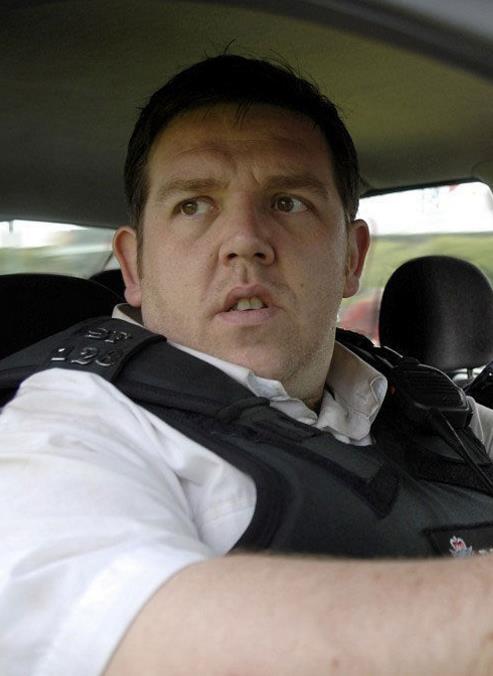
Where is `glass`? This screenshot has width=493, height=676. glass is located at coordinates (431, 215).